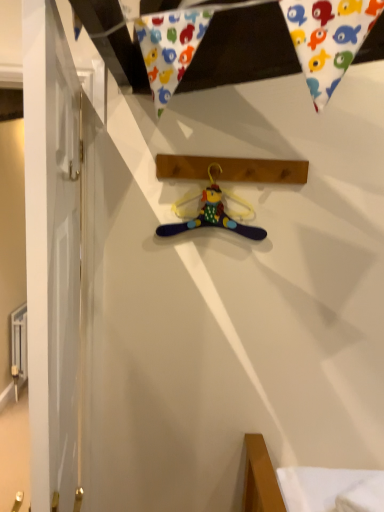
In order to face purple fabric hanger at center, should I rotate leftwards or rightwards?

Turn right approximately 2.417 degrees to face it.

Where is `purple fabric hanger at center`? Image resolution: width=384 pixels, height=512 pixels. purple fabric hanger at center is located at coordinates (212, 212).

The width and height of the screenshot is (384, 512). What do you see at coordinates (212, 212) in the screenshot?
I see `purple fabric hanger at center` at bounding box center [212, 212].

Measure the distance between point (208,162) and camera.

Point (208,162) is 1.51 meters away from camera.

What are the coordinates of `brown wooden plank at center` in the screenshot? It's located at (231, 169).

Describe the element at coordinates (231, 169) in the screenshot. This screenshot has width=384, height=512. I see `brown wooden plank at center` at that location.

Where is `purple fabric hanger at center`? The width and height of the screenshot is (384, 512). purple fabric hanger at center is located at coordinates (212, 212).

Considering the positions of objects purple fabric hanger at center and brown wooden plank at center in the image provided, who is more to the left, purple fabric hanger at center or brown wooden plank at center?

purple fabric hanger at center.

Is purple fabric hanger at center in front of brown wooden plank at center?

No, purple fabric hanger at center is further to the viewer.

Does point (215, 191) come in front of point (247, 179)?

No, it is not.

From the image's perspective, is purple fabric hanger at center under brown wooden plank at center?

Yes, from the image's perspective, purple fabric hanger at center is beneath brown wooden plank at center.

From a real-world perspective, which is physically above, purple fabric hanger at center or brown wooden plank at center?

brown wooden plank at center.

Considering the sizes of objects purple fabric hanger at center and brown wooden plank at center in the image provided, who is thinner, purple fabric hanger at center or brown wooden plank at center?

With smaller width is purple fabric hanger at center.

Is purple fabric hanger at center taller or shorter than brown wooden plank at center?

purple fabric hanger at center is taller than brown wooden plank at center.

Considering the sizes of objects purple fabric hanger at center and brown wooden plank at center in the image provided, who is smaller, purple fabric hanger at center or brown wooden plank at center?

With smaller size is purple fabric hanger at center.

Consider the image. Would you say purple fabric hanger at center is inside or outside brown wooden plank at center?

purple fabric hanger at center is spatially situated outside brown wooden plank at center.

Is purple fabric hanger at center in contact with brown wooden plank at center?

purple fabric hanger at center is not next to brown wooden plank at center, and they're not touching.

Is purple fabric hanger at center turned away from brown wooden plank at center?

No.

Identify the location of hanger that is under the brown wooden plank at center (from a real-world perspective). (212, 212).

Does brown wooden plank at center appear on the left side of purple fabric hanger at center?

Incorrect, brown wooden plank at center is not on the left side of purple fabric hanger at center.

Between brown wooden plank at center and purple fabric hanger at center, which one is positioned in front?

brown wooden plank at center is closer to the camera.

Does point (220, 173) appear closer or farther from the camera than point (227, 217)?

Point (220, 173) is closer to the camera than point (227, 217).

From the image's perspective, is brown wooden plank at center above purple fabric hanger at center?

Yes, from the image's perspective, brown wooden plank at center is over purple fabric hanger at center.

From a real-world perspective, is brown wooden plank at center above or below purple fabric hanger at center?

Clearly, from a real-world perspective, brown wooden plank at center is above purple fabric hanger at center.

Can you confirm if brown wooden plank at center is thinner than purple fabric hanger at center?

Incorrect, the width of brown wooden plank at center is not less than that of purple fabric hanger at center.

Considering the relative sizes of brown wooden plank at center and purple fabric hanger at center in the image provided, is brown wooden plank at center taller than purple fabric hanger at center?

Incorrect, the height of brown wooden plank at center is not larger of that of purple fabric hanger at center.

Which of these two, brown wooden plank at center or purple fabric hanger at center, is bigger?

Bigger between the two is brown wooden plank at center.

Can we say brown wooden plank at center lies outside purple fabric hanger at center?

Yes, brown wooden plank at center is outside of purple fabric hanger at center.

Is brown wooden plank at center with purple fabric hanger at center?

brown wooden plank at center is not next to purple fabric hanger at center, and they're not touching.

Is brown wooden plank at center facing away from purple fabric hanger at center?

brown wooden plank at center is not turned away from purple fabric hanger at center.

Consider the image. How many degrees apart are the facing directions of brown wooden plank at center and purple fabric hanger at center?

1.14 degrees separate the facing orientations of brown wooden plank at center and purple fabric hanger at center.

Find the location of a particular element. The width and height of the screenshot is (384, 512). hanger on the left of brown wooden plank at center is located at coordinates (212, 212).

The width and height of the screenshot is (384, 512). Identify the location of plank on the right of purple fabric hanger at center. click(x=231, y=169).

You are a GUI agent. You are given a task and a screenshot of the screen. Output one action in this format:
    pyautogui.click(x=<x>, y=<y>)
    Task: Click on the hanger that is below the brown wooden plank at center (from the image's perspective)
    This screenshot has height=512, width=384.
    Given the screenshot: What is the action you would take?
    pyautogui.click(x=212, y=212)